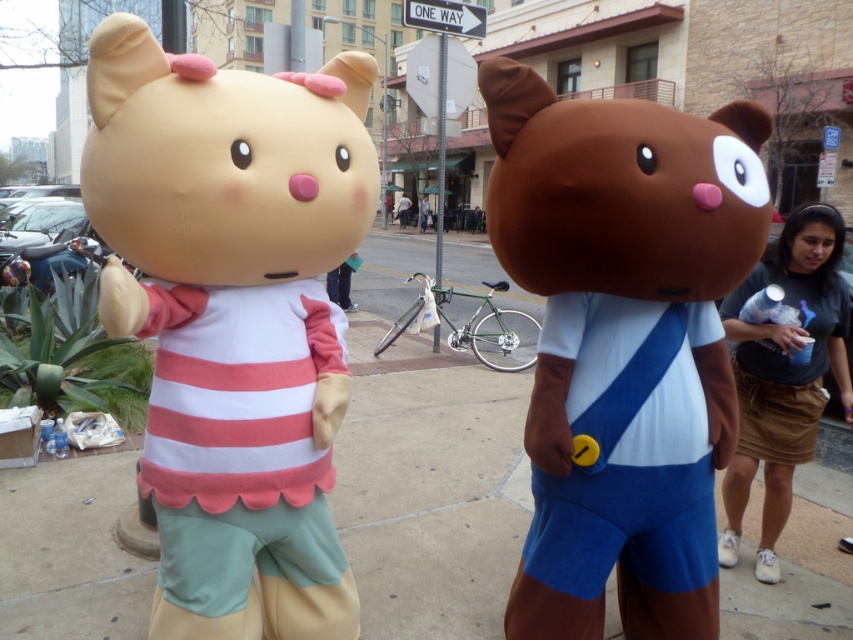
Is matte brown teddy bear at center taller than matte plastic phone at center?

Indeed, matte brown teddy bear at center has a greater height compared to matte plastic phone at center.

Who is more distant from viewer, (549, 410) or (337, 275)?

The point (337, 275) is behind.

Where is `matte brown teddy bear at center`? The image size is (853, 640). matte brown teddy bear at center is located at coordinates (622, 340).

Describe the element at coordinates (622, 340) in the screenshot. I see `matte brown teddy bear at center` at that location.

Between matte brown teddy bear at center and light blue fabric umbrella at center, which one has more height?

light blue fabric umbrella at center

Is point (692, 614) positioned in front of point (424, 205)?

That is True.

At what (x,y) coordinates should I click in order to perform the action: click on matte brown teddy bear at center. Please return your answer as a coordinate pair (x, y). This screenshot has height=640, width=853. Looking at the image, I should click on pos(622,340).

Does brown cotton skirt at lower right appear under white fabric shirt at center?

Correct, brown cotton skirt at lower right is located below white fabric shirt at center.

Is point (766, 518) closer to camera compared to point (405, 221)?

Yes, it is in front of point (405, 221).

The height and width of the screenshot is (640, 853). What do you see at coordinates (784, 372) in the screenshot?
I see `brown cotton skirt at lower right` at bounding box center [784, 372].

At what (x,y) coordinates should I click in order to perform the action: click on brown cotton skirt at lower right. Please return your answer as a coordinate pair (x, y). Looking at the image, I should click on (784, 372).